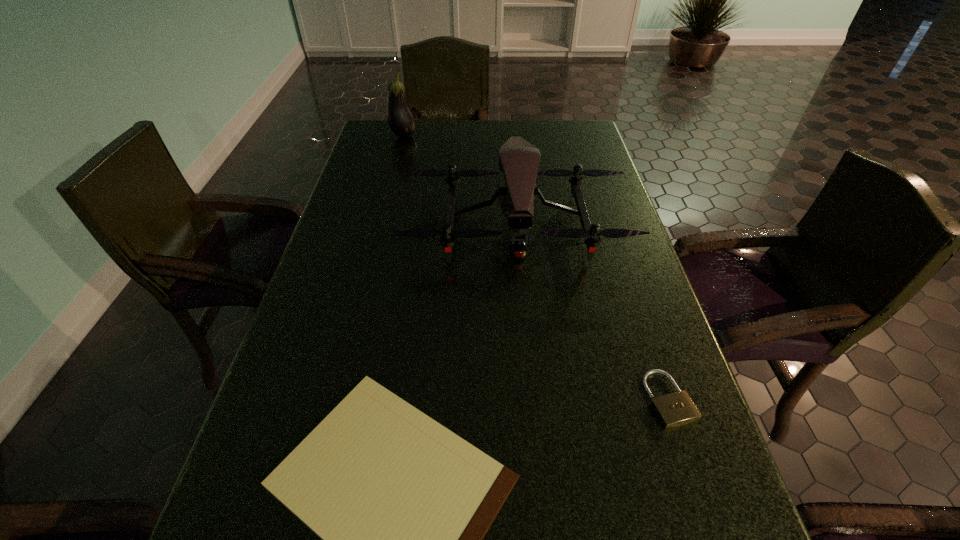
The width and height of the screenshot is (960, 540). I want to click on object located at the far left corner, so click(x=400, y=119).

In order to click on free region at the far edge of the desktop in this screenshot , I will do `click(453, 141)`.

The height and width of the screenshot is (540, 960). Identify the location of vacant region at the left edge of the desktop. (288, 402).

Locate an element on the screen. free space at the right edge is located at coordinates (596, 201).

Where is `vacant space at the far right corner of the desktop`? Image resolution: width=960 pixels, height=540 pixels. vacant space at the far right corner of the desktop is located at coordinates (556, 120).

The height and width of the screenshot is (540, 960). In order to click on free space between the third tallest object and the third nearest object in this screenshot , I will do click(x=592, y=312).

Where is `free point between the padlock and the farthest object`? This screenshot has height=540, width=960. free point between the padlock and the farthest object is located at coordinates (536, 267).

Locate an element on the screen. Image resolution: width=960 pixels, height=540 pixels. vacant region between the second shortest object and the third nearest object is located at coordinates (592, 312).

This screenshot has height=540, width=960. What are the coordinates of `free area in between the second farthest object and the third tallest object` in the screenshot? It's located at (592, 312).

Where is `object that is the closest to the clipboard`? object that is the closest to the clipboard is located at coordinates (674, 409).